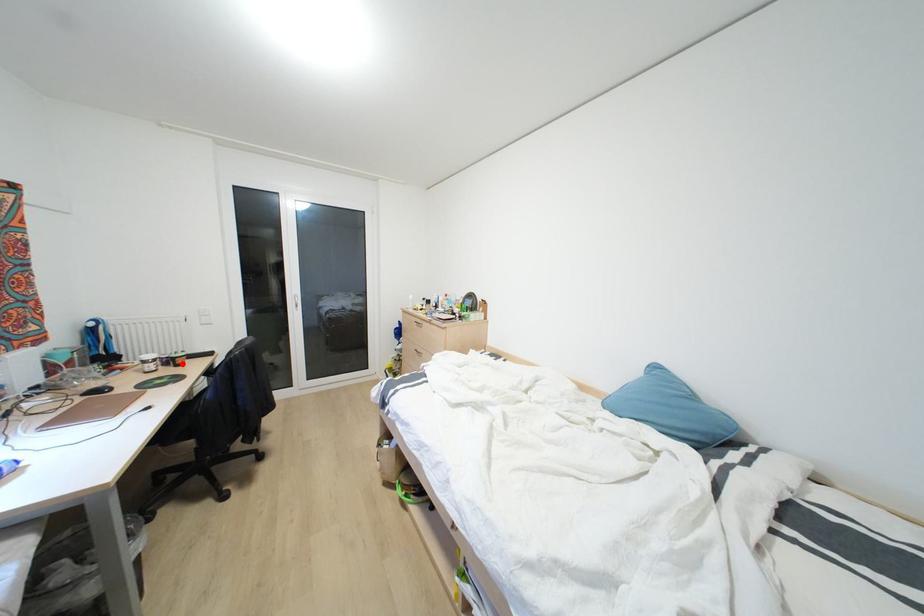
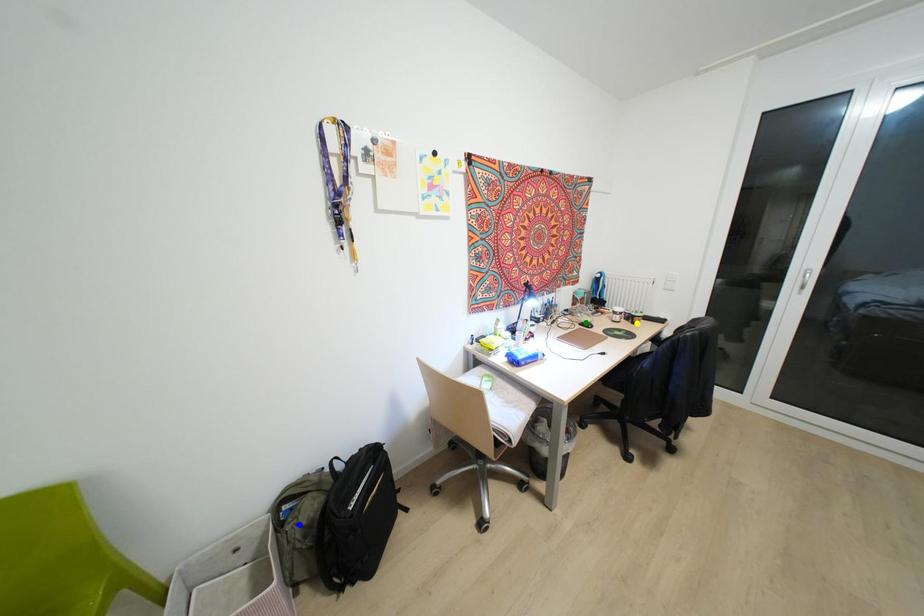
Question: I am providing you with two images of the same scene from different viewpoints. A red point is marked on the first image. You are given multiple points on the second image. Which mark in image 2 goes with the point in image 1?

Choices:
 (A) yellow point
 (B) green point
 (C) blue point

Answer: (A)